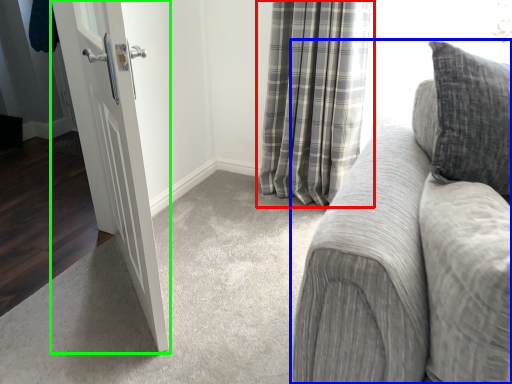
Question: Estimate the real-world distances between objects in this image. Which object is farther from curtain (highlighted by a red box), studio couch (highlighted by a blue box) or door (highlighted by a green box)?

Choices:
 (A) studio couch
 (B) door

Answer: (A)